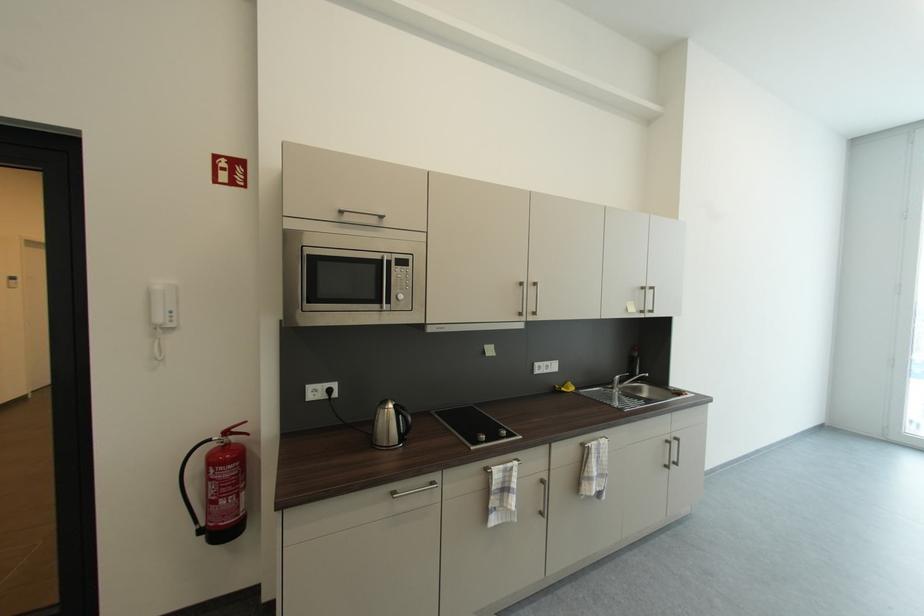
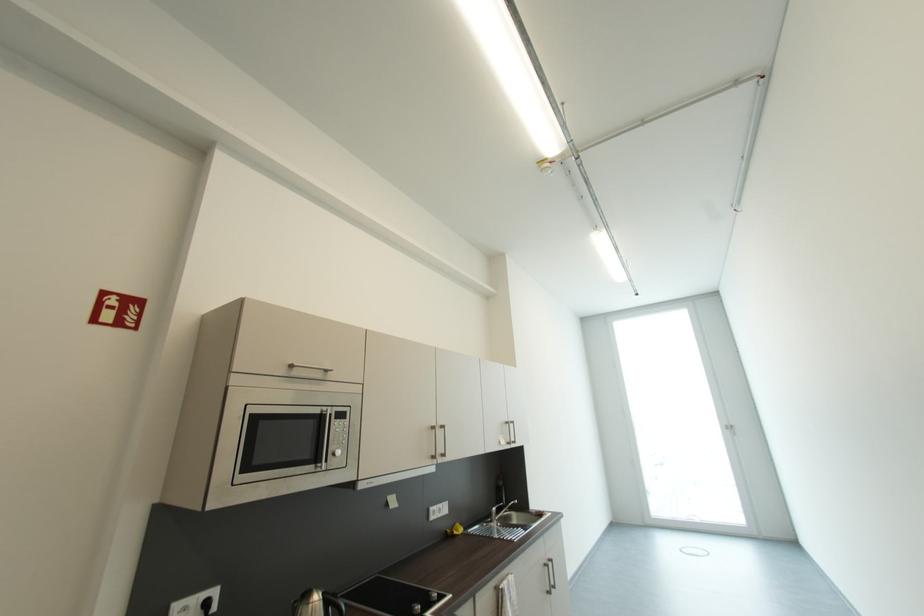
The point at (386, 259) is marked in the first image. Where is the corresponding point in the second image?

(325, 413)